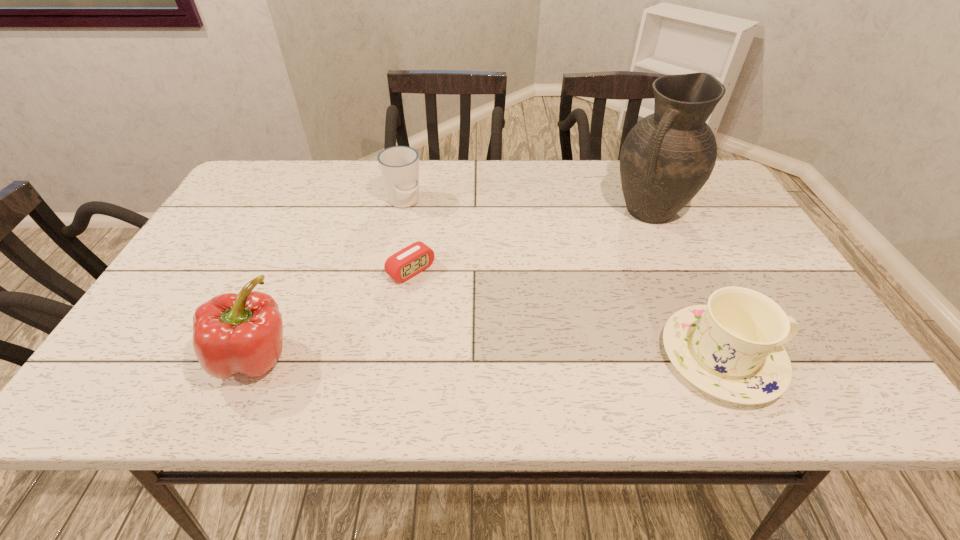
Locate an element on the screen. Image resolution: width=960 pixels, height=540 pixels. pepper is located at coordinates (242, 333).

Identify the location of chinaware. The width and height of the screenshot is (960, 540). (732, 348).

Locate an element on the screen. the shortest object is located at coordinates (415, 258).

Locate an element on the screen. The width and height of the screenshot is (960, 540). the third farthest object is located at coordinates (415, 258).

You are a GUI agent. You are given a task and a screenshot of the screen. Output one action in this format:
    pyautogui.click(x=<x>, y=<y>)
    Task: Click on the cup
    The width and height of the screenshot is (960, 540).
    Given the screenshot: What is the action you would take?
    pyautogui.click(x=399, y=165)

Locate an element on the screen. pitcher is located at coordinates (667, 157).

The height and width of the screenshot is (540, 960). Identify the location of vacant space located on the right of the pepper. (477, 356).

Where is `vacant area situated on the handle side of the chinaware`? Image resolution: width=960 pixels, height=540 pixels. vacant area situated on the handle side of the chinaware is located at coordinates (809, 357).

What are the coordinates of `vacant space located on the front-facing side of the shortest object` in the screenshot? It's located at (456, 307).

You are a GUI agent. You are given a task and a screenshot of the screen. Output one action in this format:
    pyautogui.click(x=<x>, y=<y>)
    Task: Click on the free space located 0.300m on the front-facing side of the shortest object
    
    Given the screenshot: What is the action you would take?
    coord(518,359)